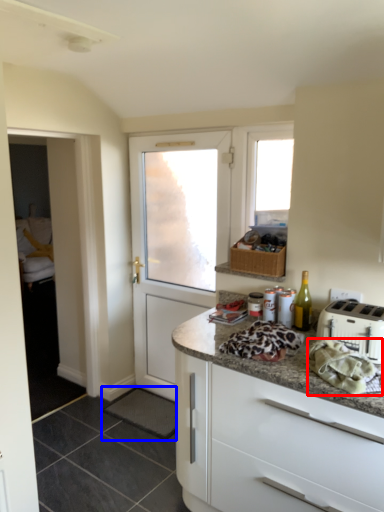
Question: Which object is closer to the camera taking this photo, material (highlighted by a red box) or tile (highlighted by a blue box)?

Choices:
 (A) material
 (B) tile

Answer: (A)